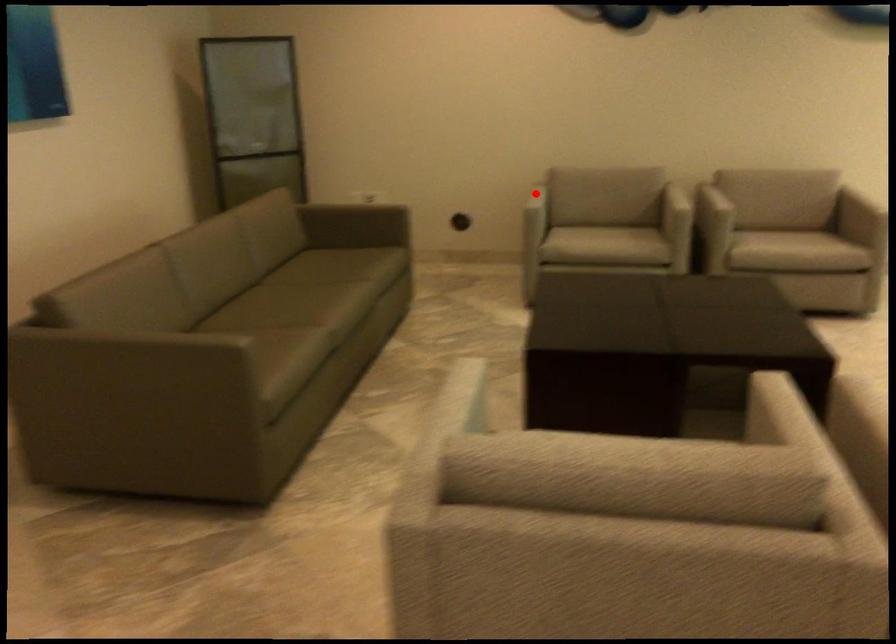
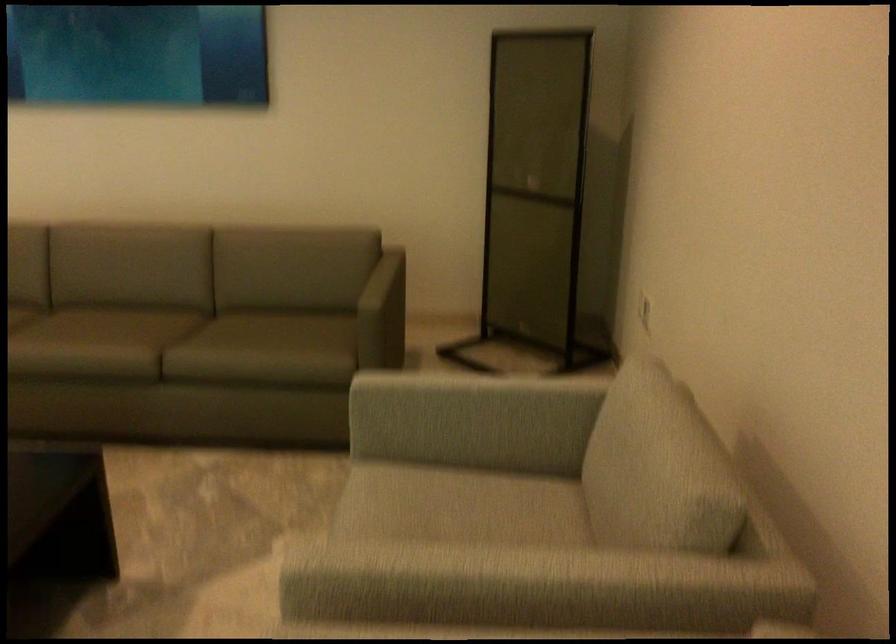
Question: I am providing you with two images of the same scene from different viewpoints. In image1, a red point is highlighted. Considering the same 3D point in image2, which of the following is correct?

Choices:
 (A) It is closer
 (B) It is farther

Answer: (A)